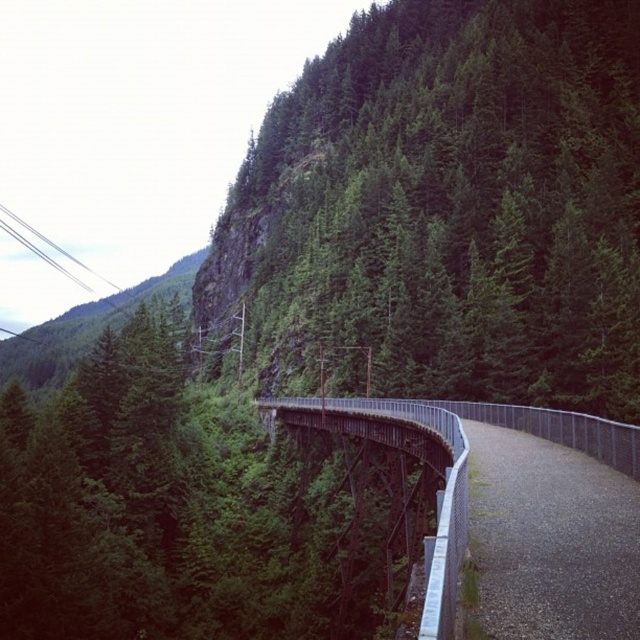
You are standing at the point marked as point [445,209] in the image. What can you see around you?

The point [445,209] is on a green leafy tree at center, so you are surrounded by the dense foliage of the tree and the forested mountainous area.

You are a hiker standing on the metallic gray bridge at center. Looking around, you notice a green leafy tree at center. Is the tree located above or below the bridge?

The green leafy tree at center is above the metallic gray bridge at center, so the tree is located above the bridge.